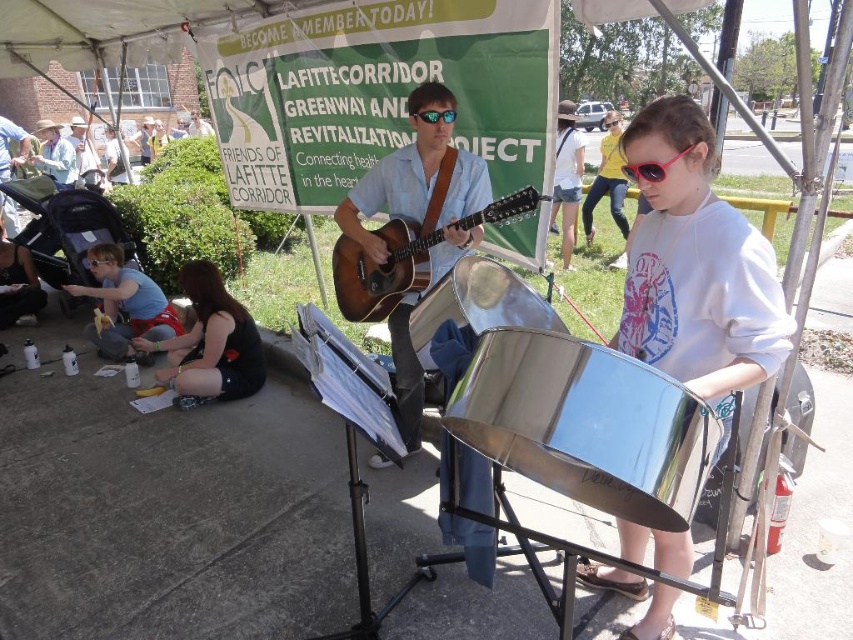
Is polished stainless steel steelpan at center shorter than clear plastic goggles at lower left?

In fact, polished stainless steel steelpan at center may be taller than clear plastic goggles at lower left.

Is the position of polished stainless steel steelpan at center more distant than that of clear plastic goggles at lower left?

No.

Which is behind, point (544, 307) or point (90, 268)?

Point (90, 268)

Where is `polished stainless steel steelpan at center`? The height and width of the screenshot is (640, 853). polished stainless steel steelpan at center is located at coordinates (x=480, y=301).

Can you confirm if polished stainless steel steelpan at center is wider than yellow t-shirt at center?

Incorrect, polished stainless steel steelpan at center's width does not surpass yellow t-shirt at center's.

In order to click on polished stainless steel steelpan at center in this screenshot , I will do (480, 301).

Can you confirm if black fabric shirt at lower left is positioned above sunglasses at center?

Incorrect, black fabric shirt at lower left is not positioned above sunglasses at center.

What do you see at coordinates (210, 342) in the screenshot? I see `black fabric shirt at lower left` at bounding box center [210, 342].

Which is behind, point (238, 336) or point (612, 124)?

The point (612, 124) is behind.

At what (x,y) coordinates should I click in order to perform the action: click on black fabric shirt at lower left. Please return your answer as a coordinate pair (x, y). Looking at the image, I should click on (210, 342).